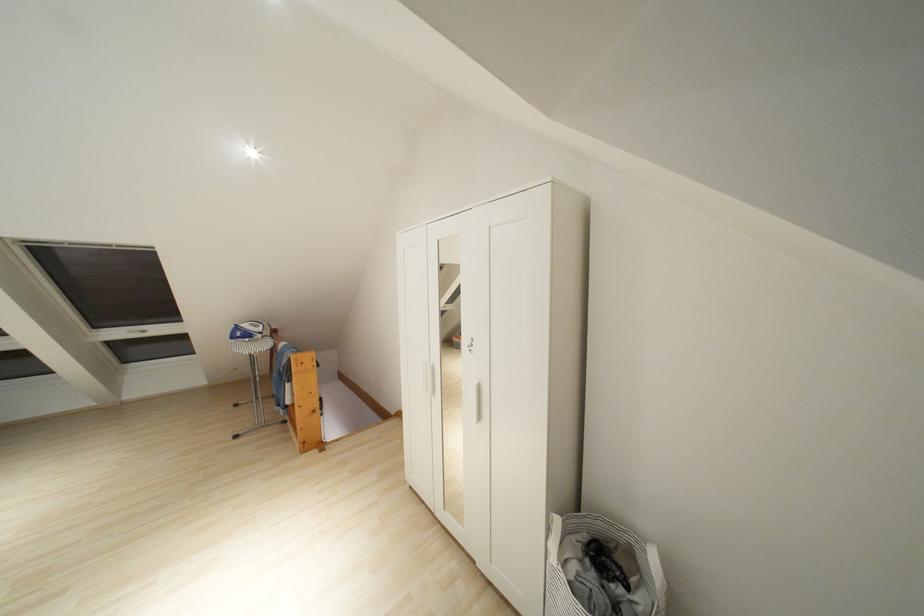
This screenshot has height=616, width=924. In order to click on window handle in this screenshot , I will do `click(139, 331)`.